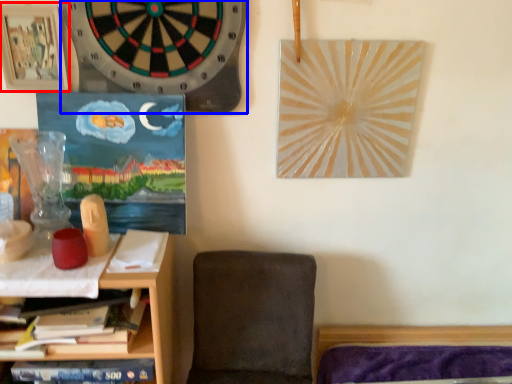
Question: Which of the following is the farthest to the observer, picture frame (highlighted by a red box) or clock (highlighted by a blue box)?

Choices:
 (A) picture frame
 (B) clock

Answer: (A)